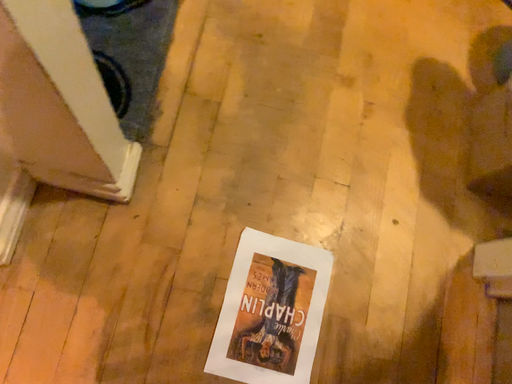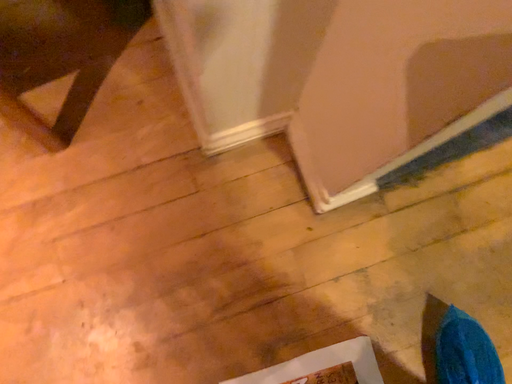
Question: Which way did the camera rotate in the video?

Choices:
 (A) rotated upward
 (B) rotated downward

Answer: (A)